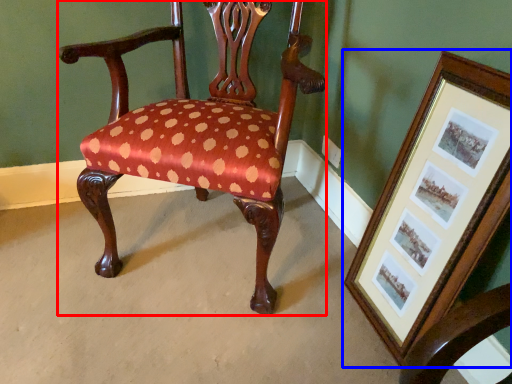
Question: Which object appears closest to the camera in this image, chair (highlighted by a red box) or picture frame (highlighted by a blue box)?

Choices:
 (A) chair
 (B) picture frame

Answer: (B)